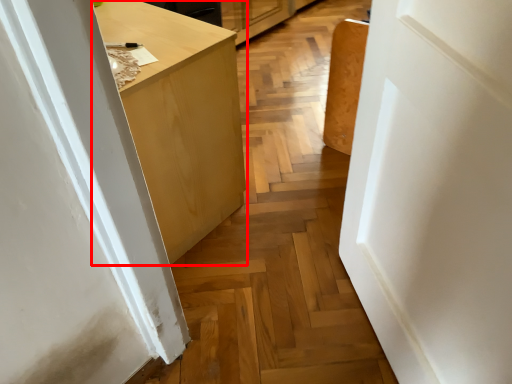
Question: Considering the relative positions of cabinetry (annotated by the red box) and door in the image provided, where is cabinetry (annotated by the red box) located with respect to the staircase?

Choices:
 (A) right
 (B) left

Answer: (B)